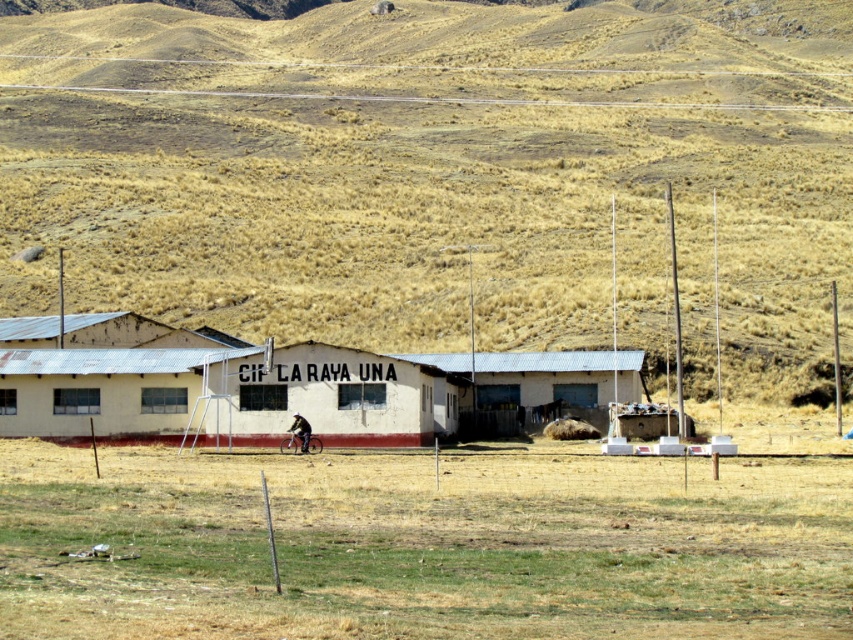
Based on the photo, you are a hiker standing at the base of the brown grassy hillside at upper center. You want to reach the white corrugated metal building at center. Which direction should you head towards?

The brown grassy hillside at upper center is to the right of the white corrugated metal building at center, so you should head towards the left to reach the building.

You are standing at the point marked by the coordinates point (x=421, y=545) in the image. What do you see directly in front of you?

The point (x=421, y=545) indicates green grass at center, so you would see green grass directly in front of you.